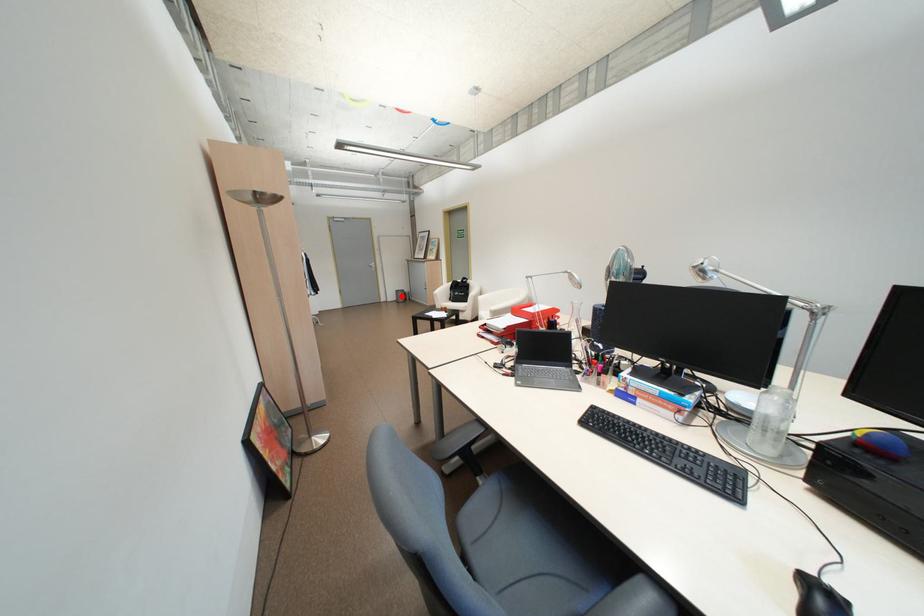
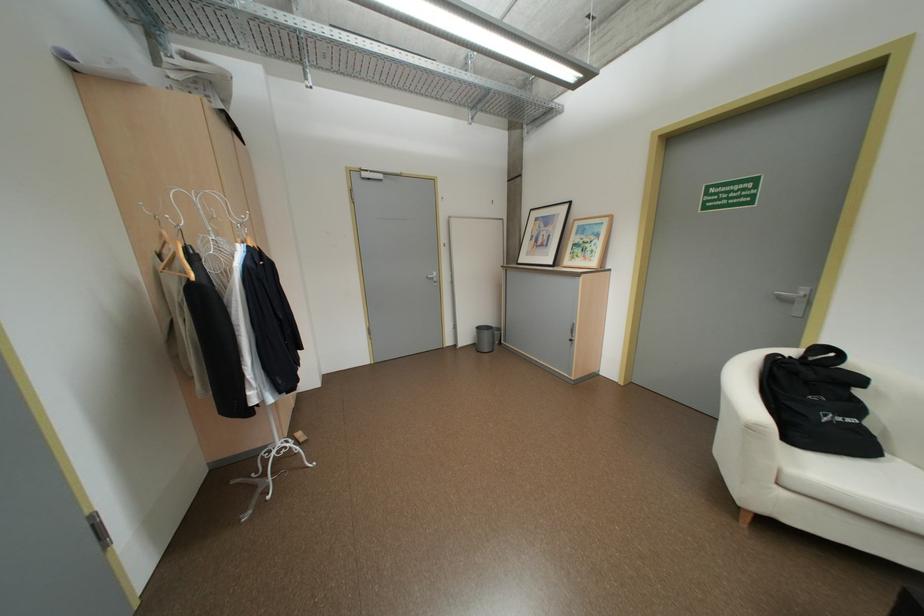
Question: A red point is marked in image1. In image2, is the corresponding 3D point closer to the camera or farther? Reply with the corresponding letter.

Choices:
 (A) The corresponding 3D point is closer.
 (B) The corresponding 3D point is farther.

Answer: (B)